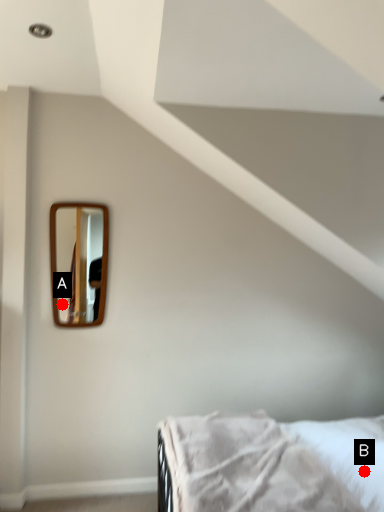
Question: Two points are circled on the image, labeled by A and B beside each circle. Which point is closer to the camera?

Choices:
 (A) A is closer
 (B) B is closer

Answer: (B)